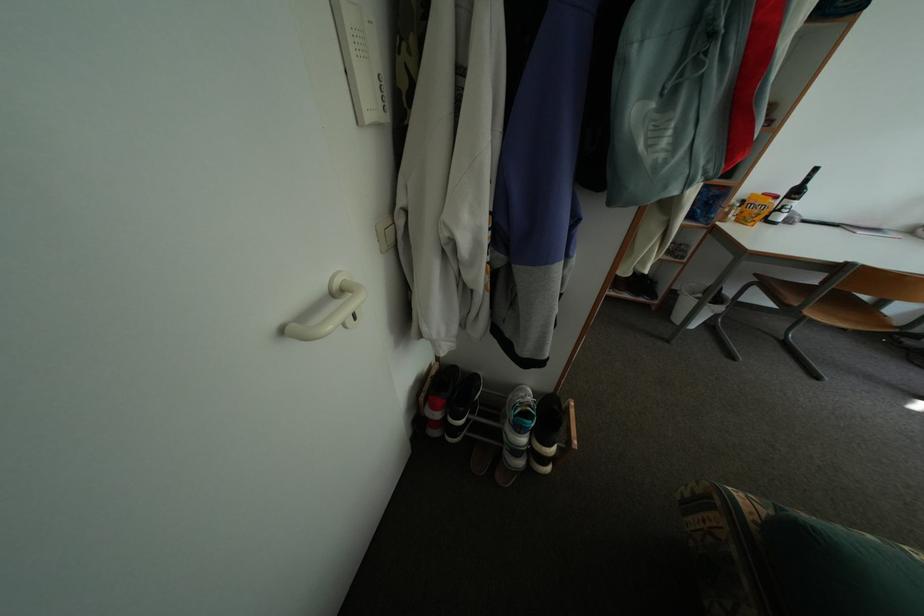
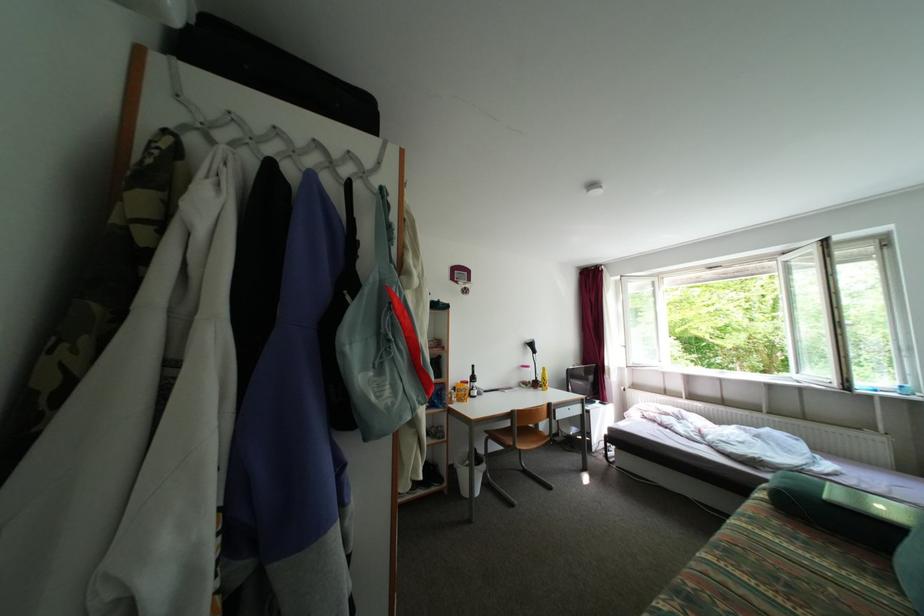
Based on the continuous images, in which direction is the camera rotating?

The rotation direction of the camera is right-up.